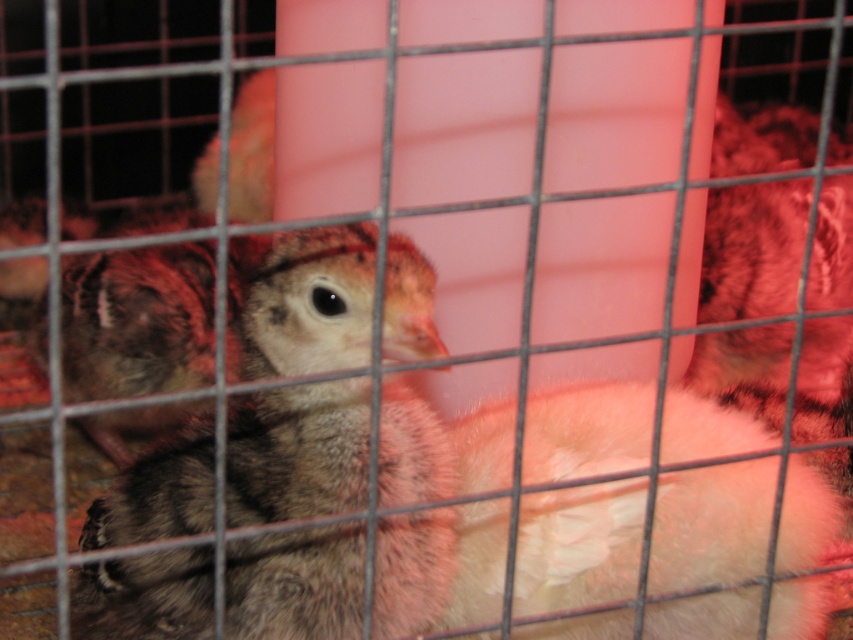
Question: Which of the following is the closest to the observer?

Choices:
 (A) (376, 596)
 (B) (726, 416)
 (C) (757, 312)

Answer: (A)

Question: Which of the following is the farthest from the observer?

Choices:
 (A) (393, 320)
 (B) (467, 577)

Answer: (B)

Question: Does fluffy white chicken at center have a larger size compared to fluffy brown chicken at center?

Choices:
 (A) no
 (B) yes

Answer: (A)

Question: Can you confirm if fluffy brown chicken at center is thinner than speckled feathered chicken at left?

Choices:
 (A) yes
 (B) no

Answer: (B)

Question: Is speckled feathered chick at center further to the viewer compared to fluffy brown chicken at center?

Choices:
 (A) yes
 (B) no

Answer: (B)

Question: Estimate the real-world distances between objects in this image. Which object is farther from the fluffy white chicken at center?

Choices:
 (A) speckled feathered chick at center
 (B) speckled feathered chicken at left

Answer: (B)